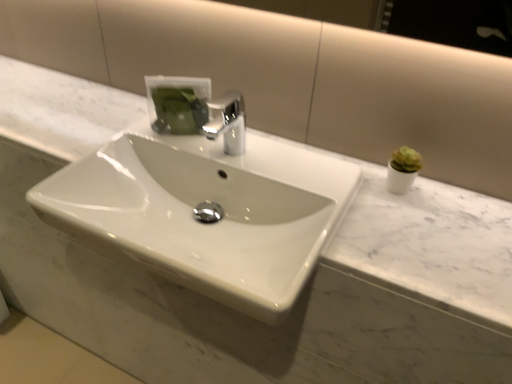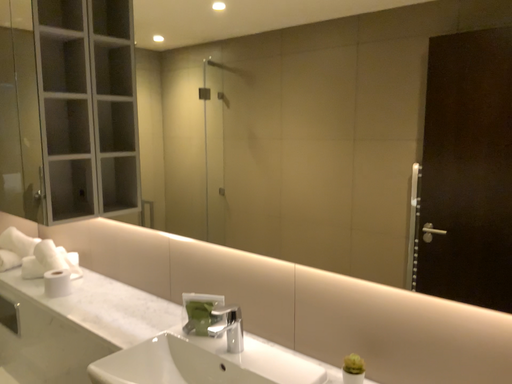
Question: Which way did the camera rotate in the video?

Choices:
 (A) rotated left
 (B) rotated right

Answer: (A)